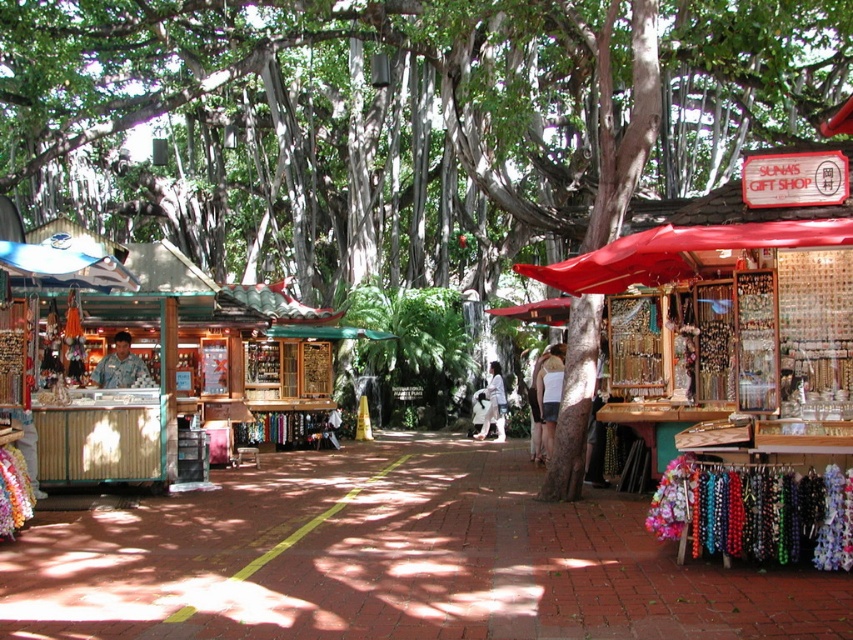
Which of these two, red fabric umbrella at right or white fabric at center, stands shorter?

Standing shorter between the two is red fabric umbrella at right.

Between red fabric umbrella at right and white fabric at center, which one is positioned lower?

white fabric at center is lower down.

Image resolution: width=853 pixels, height=640 pixels. In order to click on red fabric umbrella at right in this screenshot , I will do `click(676, 252)`.

Which is in front, point (113, 340) or point (532, 369)?

Point (113, 340)

This screenshot has width=853, height=640. Describe the element at coordinates (120, 365) in the screenshot. I see `camouflage uniform at center` at that location.

This screenshot has width=853, height=640. Find the location of `camouflage uniform at center`. camouflage uniform at center is located at coordinates (120, 365).

Is red fabric umbrella at right to the left of white cotton shirt at center from the viewer's perspective?

In fact, red fabric umbrella at right is to the right of white cotton shirt at center.

How much distance is there between red fabric umbrella at right and white cotton shirt at center?

A distance of 17.86 feet exists between red fabric umbrella at right and white cotton shirt at center.

Is point (788, 240) more distant than point (541, 371)?

No, it is in front of (541, 371).

Identify the location of red fabric umbrella at right. (676, 252).